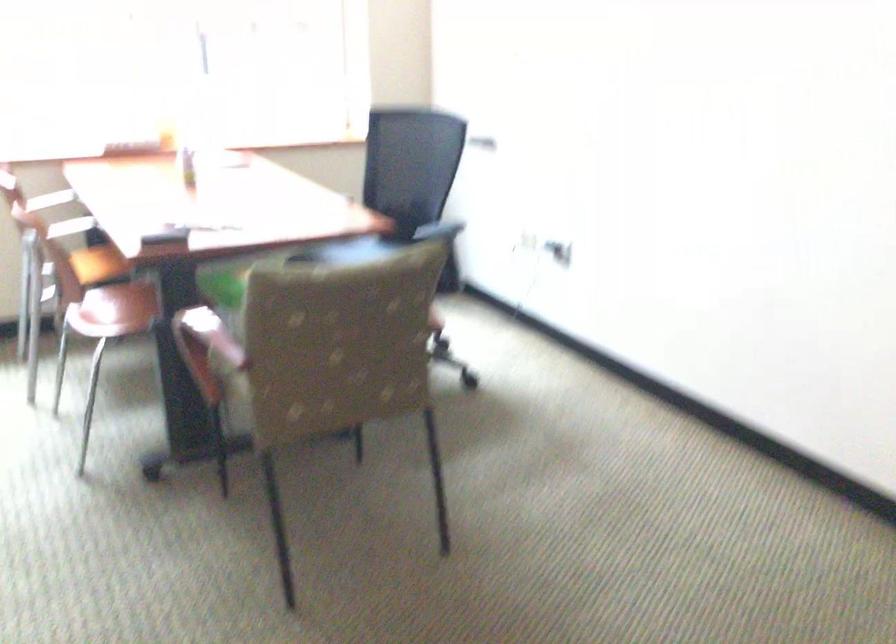
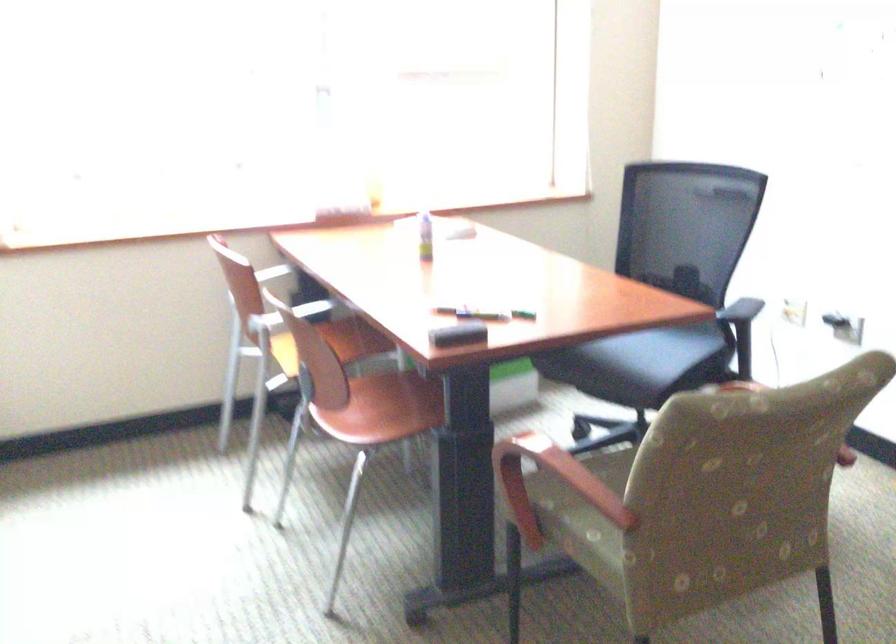
Where in the second image is the point corresponding to pixel 203 328 from the first image?

(561, 475)